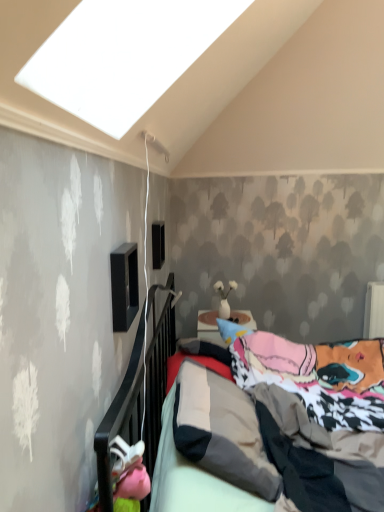
Question: Would you consider black matte speaker at upper left, arranged as the 1th window when viewed from the front, to be distant from black matte window at upper center, which is the 2th window in front-to-back order?

Choices:
 (A) no
 (B) yes

Answer: (B)

Question: Considering the relative positions of black matte speaker at upper left, arranged as the 1th window when viewed from the front, and black matte window at upper center, which appears as the 1th window when viewed from the back, in the image provided, is black matte speaker at upper left, arranged as the 1th window when viewed from the front, to the right of black matte window at upper center, which appears as the 1th window when viewed from the back, from the viewer's perspective?

Choices:
 (A) no
 (B) yes

Answer: (A)

Question: From the image's perspective, does black matte speaker at upper left, which ranks as the second window in back-to-front order, appear lower than black matte window at upper center, which appears as the 1th window when viewed from the back?

Choices:
 (A) no
 (B) yes

Answer: (B)

Question: Is black matte speaker at upper left, which ranks as the second window in back-to-front order, positioned before black matte window at upper center, which appears as the 1th window when viewed from the back?

Choices:
 (A) no
 (B) yes

Answer: (B)

Question: Considering the relative sizes of black matte speaker at upper left, which ranks as the second window in back-to-front order, and black matte window at upper center, which appears as the 1th window when viewed from the back, in the image provided, is black matte speaker at upper left, which ranks as the second window in back-to-front order, thinner than black matte window at upper center, which appears as the 1th window when viewed from the back,?

Choices:
 (A) no
 (B) yes

Answer: (A)

Question: From a real-world perspective, is black matte window at upper center, which appears as the 1th window when viewed from the back, physically located above or below black matte speaker at upper left, arranged as the 1th window when viewed from the front?

Choices:
 (A) below
 (B) above

Answer: (B)

Question: Is black matte window at upper center, which appears as the 1th window when viewed from the back, inside or outside of black matte speaker at upper left, which ranks as the second window in back-to-front order?

Choices:
 (A) inside
 (B) outside

Answer: (B)

Question: Considering the positions of black matte window at upper center, which appears as the 1th window when viewed from the back, and black matte speaker at upper left, arranged as the 1th window when viewed from the front, in the image, is black matte window at upper center, which appears as the 1th window when viewed from the back, wider or thinner than black matte speaker at upper left, arranged as the 1th window when viewed from the front,?

Choices:
 (A) wide
 (B) thin

Answer: (B)

Question: In terms of size, does black matte window at upper center, which is the 2th window in front-to-back order, appear bigger or smaller than black matte speaker at upper left, arranged as the 1th window when viewed from the front?

Choices:
 (A) big
 (B) small

Answer: (B)

Question: Is black matte speaker at upper left, which ranks as the second window in back-to-front order, taller or shorter than mattress at center?

Choices:
 (A) tall
 (B) short

Answer: (B)

Question: From a real-world perspective, is black matte speaker at upper left, arranged as the 1th window when viewed from the front, positioned above or below mattress at center?

Choices:
 (A) below
 (B) above

Answer: (B)

Question: Would you say black matte speaker at upper left, arranged as the 1th window when viewed from the front, is to the left or to the right of mattress at center in the picture?

Choices:
 (A) left
 (B) right

Answer: (A)

Question: From the image's perspective, is black matte speaker at upper left, arranged as the 1th window when viewed from the front, positioned above or below mattress at center?

Choices:
 (A) below
 (B) above

Answer: (B)

Question: Is mattress at center taller or shorter than black matte speaker at upper left, arranged as the 1th window when viewed from the front?

Choices:
 (A) tall
 (B) short

Answer: (A)

Question: In terms of width, does mattress at center look wider or thinner when compared to black matte speaker at upper left, which ranks as the second window in back-to-front order?

Choices:
 (A) wide
 (B) thin

Answer: (A)